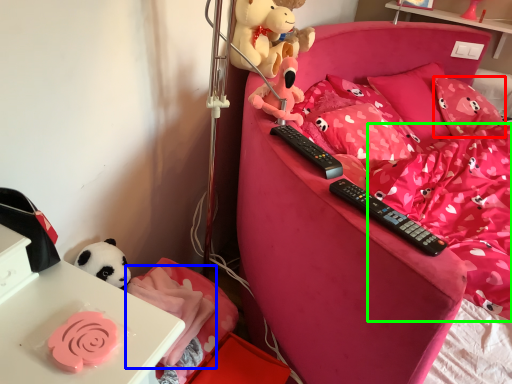
Question: Based on their relative distances, which object is farther from pillow (highlighted by a red box)? Choose from blanket (highlighted by a blue box) and bedding (highlighted by a green box).

Choices:
 (A) blanket
 (B) bedding

Answer: (A)